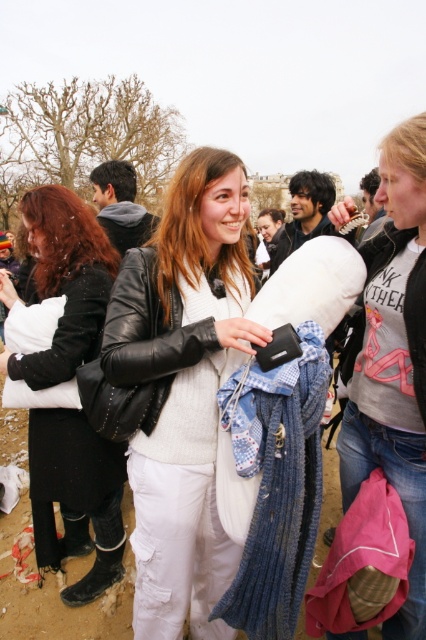
Question: Which of the following is the farthest from the observer?

Choices:
 (A) matte black jacket at center
 (B) white fluffy pillow at left

Answer: (B)

Question: Is matte black jacket at center to the right of white fluffy pillow at left from the viewer's perspective?

Choices:
 (A) no
 (B) yes

Answer: (B)

Question: Is matte black jacket at center smaller than white fluffy pillow at left?

Choices:
 (A) yes
 (B) no

Answer: (A)

Question: Among these objects, which one is farthest from the camera?

Choices:
 (A) matte black jacket at center
 (B) white fluffy pillow at left

Answer: (B)

Question: Is matte black jacket at center wider than white fluffy pillow at left?

Choices:
 (A) no
 (B) yes

Answer: (B)

Question: Which of the following is the farthest from the observer?

Choices:
 (A) (221, 588)
 (B) (66, 419)

Answer: (B)